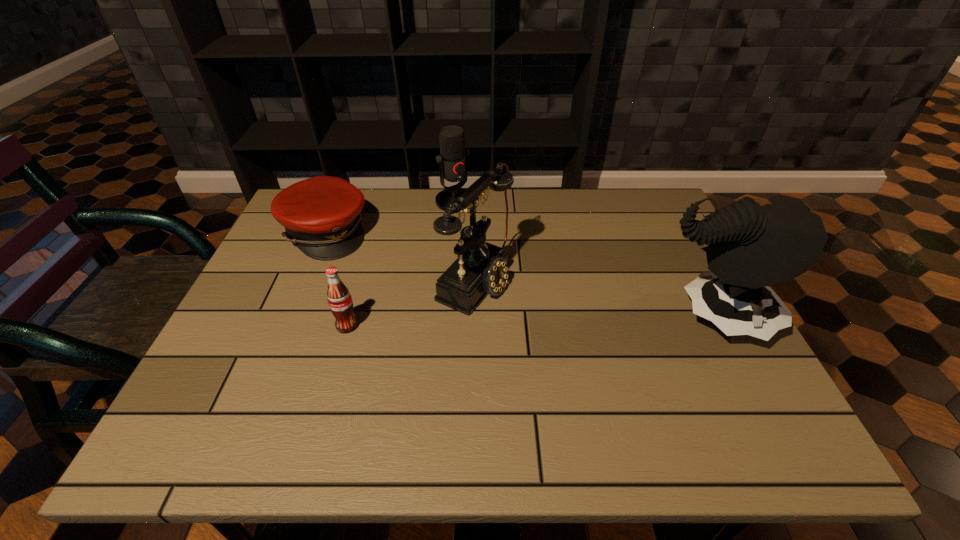
The height and width of the screenshot is (540, 960). In order to click on vacant area located 0.340m on the front of the shortest object with an emblem in this screenshot , I will do `click(449, 302)`.

At what (x,y) coordinates should I click in order to perform the action: click on free space located 0.100m on the front of the shortest object with an emblem. Please return your answer as a coordinate pair (x, y). The image size is (960, 540). Looking at the image, I should click on (380, 263).

This screenshot has width=960, height=540. Identify the location of vacant point located on the dial of the telephone. (552, 315).

In order to click on free space located 0.080m on the dial of the telephone in this screenshot , I will do `click(537, 309)`.

You are a GUI agent. You are given a task and a screenshot of the screen. Output one action in this format:
    pyautogui.click(x=<x>, y=<y>)
    Task: Click on the free space located 0.060m on the dial of the telephone
    
    Given the screenshot: What is the action you would take?
    pyautogui.click(x=529, y=306)

Locate an element on the screen. This screenshot has height=540, width=960. microphone that is at the far edge is located at coordinates (452, 160).

Find the location of a particular element. The width and height of the screenshot is (960, 540). cap that is at the far edge is located at coordinates (321, 215).

At what (x,y) coordinates should I click in order to perform the action: click on object situated at the left edge. Please return your answer as a coordinate pair (x, y). The height and width of the screenshot is (540, 960). Looking at the image, I should click on (321, 215).

At what (x,y) coordinates should I click in order to perform the action: click on object situated at the right edge. Please return your answer as a coordinate pair (x, y). Looking at the image, I should click on (750, 247).

Find the location of a particular element. The width and height of the screenshot is (960, 540). object positioned at the far left corner is located at coordinates (321, 215).